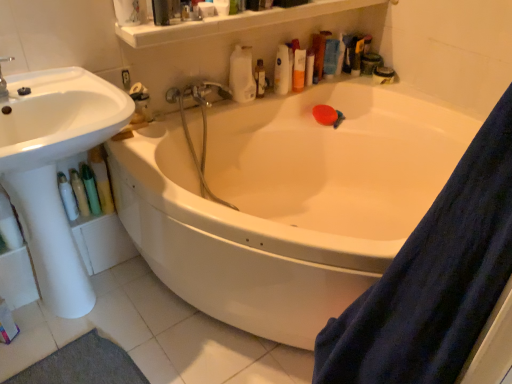
The width and height of the screenshot is (512, 384). What are the coordinates of `unoccupied region to the right of white glossy sink at left` in the screenshot? It's located at (188, 347).